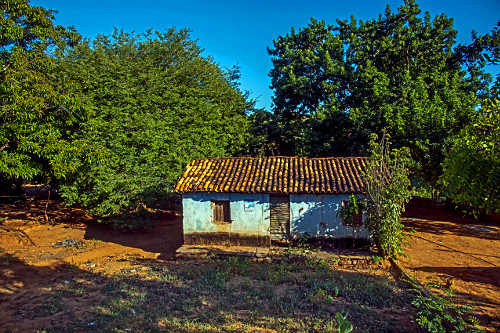
You are a GUI agent. You are given a task and a screenshot of the screen. Output one action in this format:
    pyautogui.click(x=<x>, y=<y>)
    Task: Click on the door
    
    Given the screenshot: What is the action you would take?
    pyautogui.click(x=277, y=208)